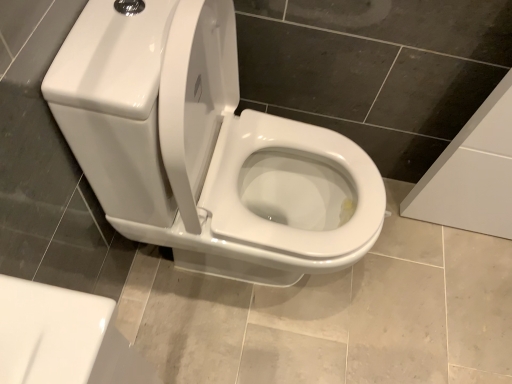
Find the location of a particular element. The width and height of the screenshot is (512, 384). white glossy toilet at center is located at coordinates (205, 149).

What do you see at coordinates (205, 149) in the screenshot?
I see `white glossy toilet at center` at bounding box center [205, 149].

You are a GUI agent. You are given a task and a screenshot of the screen. Output one action in this format:
    pyautogui.click(x=<x>, y=<y>)
    Task: Click on the white glossy toilet at center
    This screenshot has height=384, width=512.
    Given the screenshot: What is the action you would take?
    pyautogui.click(x=205, y=149)